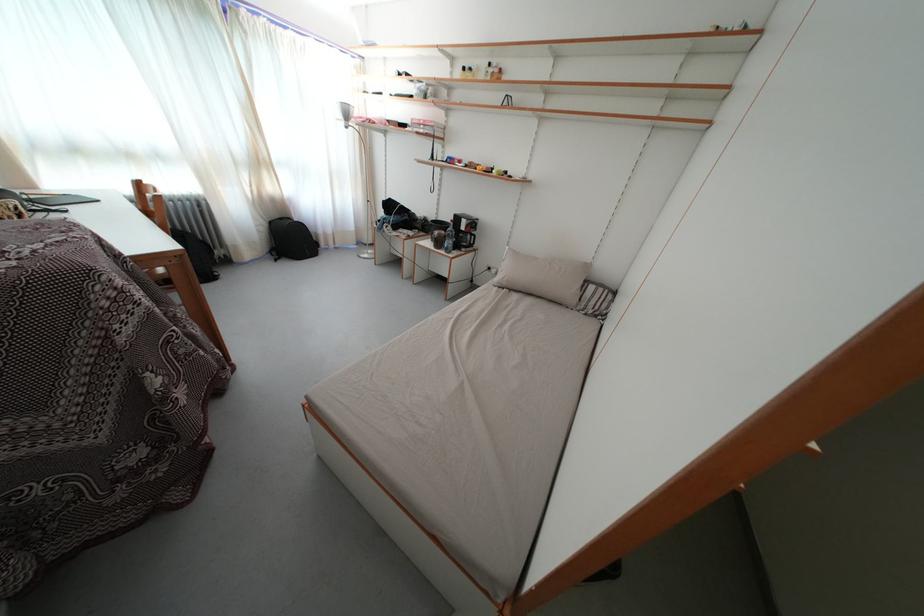
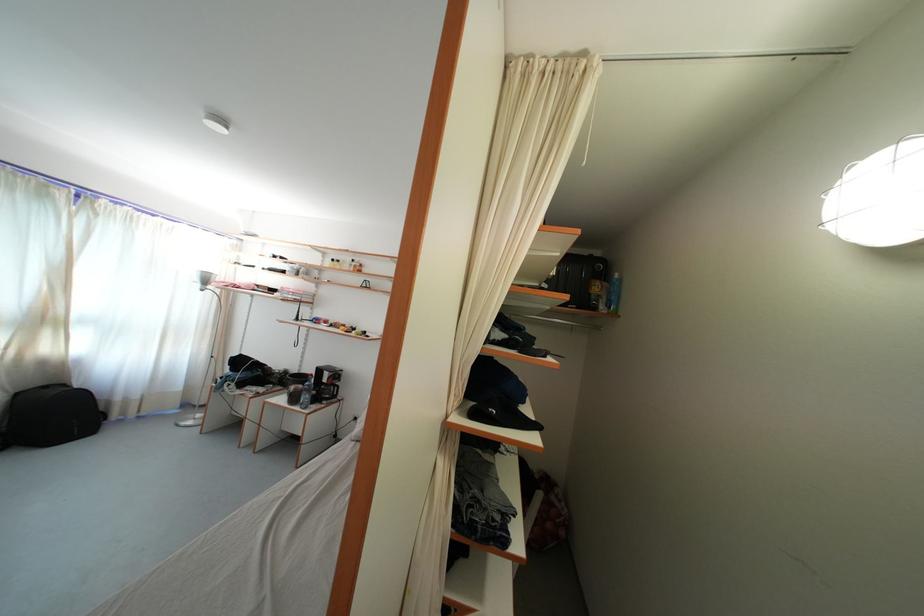
In the second image, find the point that corresponds to (276,229) in the first image.

(23, 400)